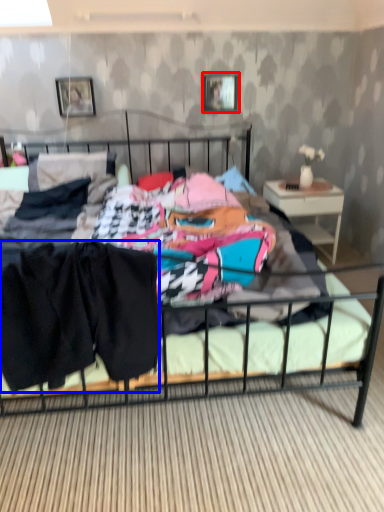
Question: Which object is closer to the camera taking this photo, picture frame (highlighted by a red box) or clothing (highlighted by a blue box)?

Choices:
 (A) picture frame
 (B) clothing

Answer: (B)